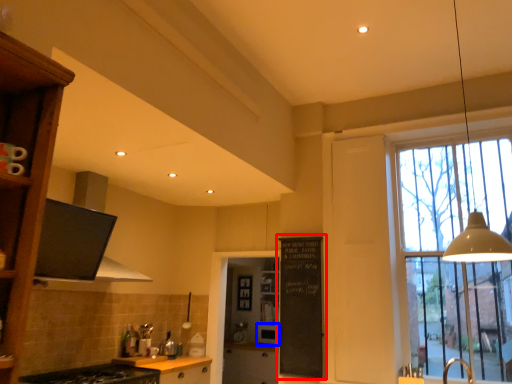
Question: Which point is closer to the camera, bulletin board (highlighted by a red box) or appliance (highlighted by a blue box)?

Choices:
 (A) bulletin board
 (B) appliance

Answer: (A)